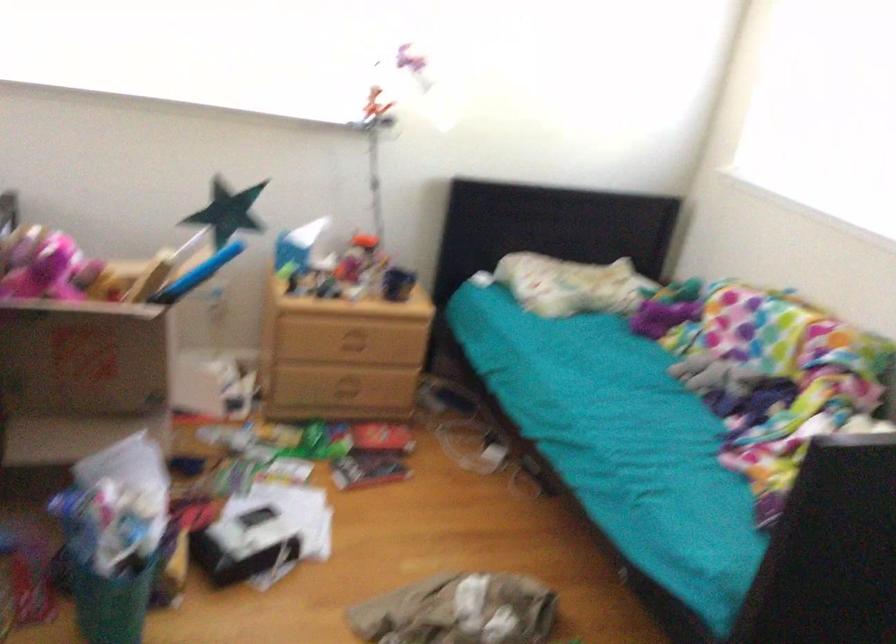
Based on the continuous images, in which direction is the camera rotating?

The rotation direction of the camera is left-down.